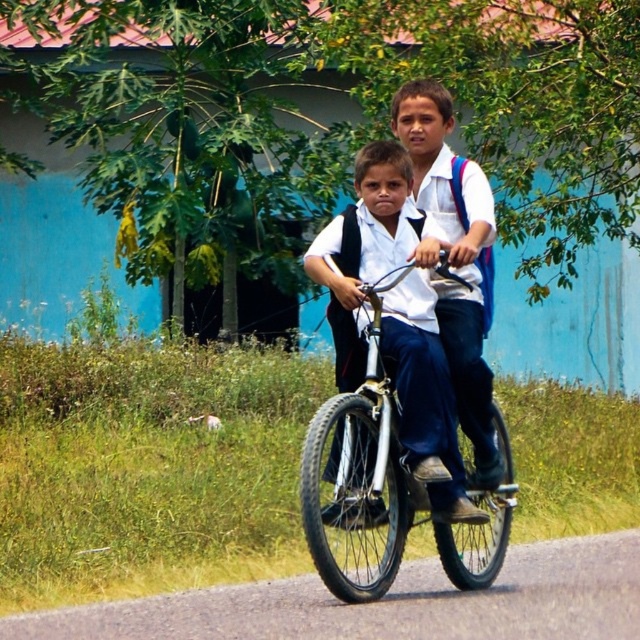
Question: Does metallic silver bicycle at center appear on the left side of white matte shirt at center?

Choices:
 (A) no
 (B) yes

Answer: (B)

Question: Which of the following is the farthest from the observer?

Choices:
 (A) (490, 497)
 (B) (461, 352)

Answer: (A)

Question: Which point is closer to the camera taking this photo?

Choices:
 (A) (337, 470)
 (B) (442, 106)

Answer: (A)

Question: Among these points, which one is nearest to the camera?

Choices:
 (A) (464, 216)
 (B) (317, 419)

Answer: (B)

Question: Can you confirm if metallic silver bicycle at center is positioned above white matte shirt at center?

Choices:
 (A) yes
 (B) no

Answer: (B)

Question: Can you confirm if metallic silver bicycle at center is wider than white matte shirt at center?

Choices:
 (A) yes
 (B) no

Answer: (A)